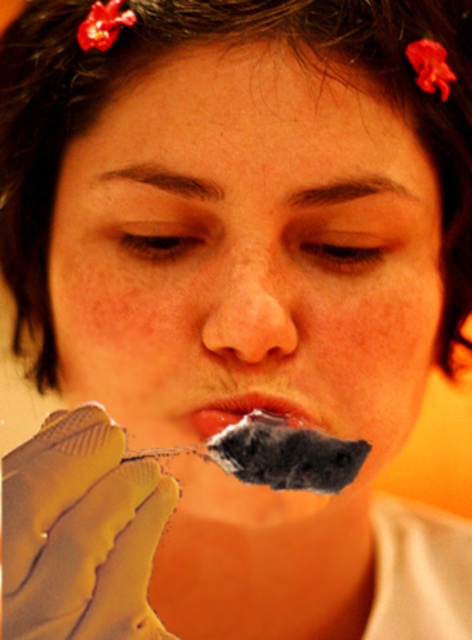
Question: Which object appears farthest from the camera in this image?

Choices:
 (A) smooth matte lips at center
 (B) smooth matte skin at center

Answer: (A)

Question: Is rubber glove at lower left thinner than smooth flesh nose at center?

Choices:
 (A) no
 (B) yes

Answer: (A)

Question: Does rubber glove at lower left have a smaller size compared to smooth matte lips at center?

Choices:
 (A) yes
 (B) no

Answer: (B)

Question: Which point is farther to the camera?

Choices:
 (A) (101, 492)
 (B) (254, 397)

Answer: (B)

Question: Which point is farther to the camera?

Choices:
 (A) (237, 342)
 (B) (92, 122)
 (C) (197, 428)
 (D) (13, 490)

Answer: (B)

Question: Is smooth matte skin at center thinner than smooth matte lips at center?

Choices:
 (A) yes
 (B) no

Answer: (B)